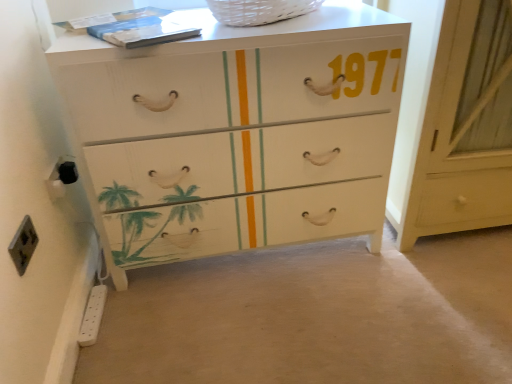
Question: Considering the relative sizes of white wood cabinet at right and white wicker basket at upper center in the image provided, is white wood cabinet at right thinner than white wicker basket at upper center?

Choices:
 (A) no
 (B) yes

Answer: (A)

Question: Is white wood cabinet at right to the right of white wicker basket at upper center from the viewer's perspective?

Choices:
 (A) no
 (B) yes

Answer: (B)

Question: Does white wood cabinet at right have a greater height compared to white wicker basket at upper center?

Choices:
 (A) no
 (B) yes

Answer: (B)

Question: Are white wood cabinet at right and white wicker basket at upper center far apart?

Choices:
 (A) no
 (B) yes

Answer: (A)

Question: Is white wood cabinet at right positioned behind white wicker basket at upper center?

Choices:
 (A) yes
 (B) no

Answer: (B)

Question: Can you confirm if white wood cabinet at right is smaller than white wicker basket at upper center?

Choices:
 (A) no
 (B) yes

Answer: (A)

Question: From a real-world perspective, is black plastic socket at lower left, marked as the 3th electric outlet in a bottom-to-top arrangement, on white wood cabinet at right?

Choices:
 (A) yes
 (B) no

Answer: (B)

Question: Is black plastic socket at lower left, the 2th electric outlet when ordered from front to back, outside of white wood cabinet at right?

Choices:
 (A) no
 (B) yes

Answer: (B)

Question: Is the depth of black plastic socket at lower left, marked as the 3th electric outlet in a bottom-to-top arrangement, less than that of white wood cabinet at right?

Choices:
 (A) yes
 (B) no

Answer: (B)

Question: Is the depth of black plastic socket at lower left, marked as the 3th electric outlet in a bottom-to-top arrangement, greater than that of white wood cabinet at right?

Choices:
 (A) no
 (B) yes

Answer: (B)

Question: Can you confirm if black plastic socket at lower left, the 2th electric outlet when ordered from front to back, is wider than white wood cabinet at right?

Choices:
 (A) yes
 (B) no

Answer: (B)

Question: Is black plastic socket at lower left, the first electric outlet from the top, next to white wood cabinet at right?

Choices:
 (A) yes
 (B) no

Answer: (B)

Question: From the image's perspective, is white painted wood chest of drawers at center on black plastic socket at lower left, the 2th electric outlet in the back-to-front sequence?

Choices:
 (A) yes
 (B) no

Answer: (A)